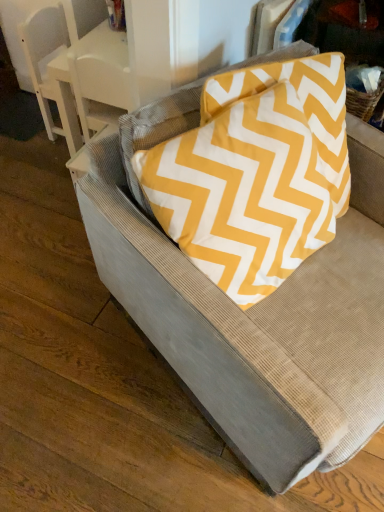
Where is `free space in front of textured gray armchair at upper left`? The width and height of the screenshot is (384, 512). free space in front of textured gray armchair at upper left is located at coordinates (44, 161).